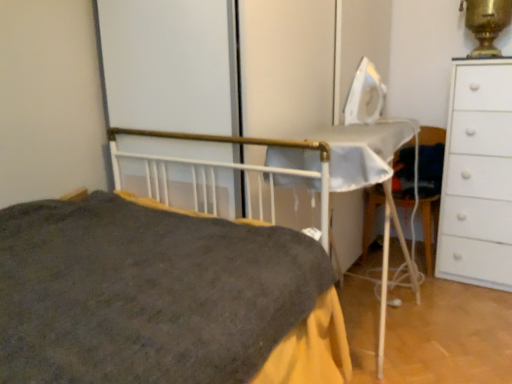
Question: Does white matte chest of drawers at right have a greater height compared to gold metallic samovar at upper right?

Choices:
 (A) no
 (B) yes

Answer: (B)

Question: Considering the relative sizes of white matte chest of drawers at right and gold metallic samovar at upper right in the image provided, is white matte chest of drawers at right wider than gold metallic samovar at upper right?

Choices:
 (A) yes
 (B) no

Answer: (A)

Question: Is white matte chest of drawers at right bigger than gold metallic samovar at upper right?

Choices:
 (A) yes
 (B) no

Answer: (A)

Question: Is white matte chest of drawers at right positioned in front of gold metallic samovar at upper right?

Choices:
 (A) no
 (B) yes

Answer: (B)

Question: Can you confirm if white matte chest of drawers at right is shorter than gold metallic samovar at upper right?

Choices:
 (A) no
 (B) yes

Answer: (A)

Question: From a real-world perspective, is gold metallic samovar at upper right physically located above or below white matte chest of drawers at right?

Choices:
 (A) below
 (B) above

Answer: (B)

Question: Relative to white matte chest of drawers at right, is gold metallic samovar at upper right in front or behind?

Choices:
 (A) front
 (B) behind

Answer: (B)

Question: Would you say gold metallic samovar at upper right is to the left or to the right of white matte chest of drawers at right in the picture?

Choices:
 (A) right
 (B) left

Answer: (B)

Question: Is point (475, 49) positioned closer to the camera than point (487, 271)?

Choices:
 (A) closer
 (B) farther

Answer: (B)

Question: Would you say gold metallic samovar at upper right is inside or outside dark gray fabric bed at center?

Choices:
 (A) inside
 (B) outside

Answer: (B)

Question: Considering the positions of gold metallic samovar at upper right and dark gray fabric bed at center in the image, is gold metallic samovar at upper right taller or shorter than dark gray fabric bed at center?

Choices:
 (A) tall
 (B) short

Answer: (B)

Question: From a real-world perspective, is gold metallic samovar at upper right positioned above or below dark gray fabric bed at center?

Choices:
 (A) above
 (B) below

Answer: (A)

Question: Looking at their shapes, would you say gold metallic samovar at upper right is wider or thinner than dark gray fabric bed at center?

Choices:
 (A) thin
 (B) wide

Answer: (A)

Question: Is dark gray fabric bed at center taller or shorter than white matte chest of drawers at right?

Choices:
 (A) short
 (B) tall

Answer: (A)

Question: From the image's perspective, relative to white matte chest of drawers at right, is dark gray fabric bed at center above or below?

Choices:
 (A) below
 (B) above

Answer: (A)